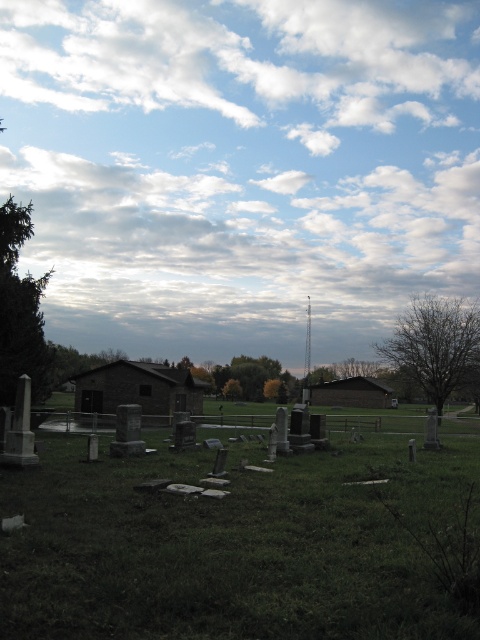
Question: Is cloudy sky at upper center thinner than green grassy at lower center?

Choices:
 (A) no
 (B) yes

Answer: (A)

Question: Which object is positioned closest to the cloudy sky at upper center?

Choices:
 (A) green grassy at lower center
 (B) green textured tree at left

Answer: (B)

Question: Considering the real-world distances, which object is farthest from the green textured tree at left?

Choices:
 (A) cloudy sky at upper center
 (B) bare branches at right
 (C) green grassy at lower center

Answer: (A)

Question: Observing the image, what is the correct spatial positioning of cloudy sky at upper center in reference to green textured tree at left?

Choices:
 (A) below
 (B) above

Answer: (B)

Question: Which object is farther from the camera taking this photo?

Choices:
 (A) green grassy at lower center
 (B) green textured tree at left
 (C) bare branches at right

Answer: (C)

Question: Is cloudy sky at upper center wider than green grassy at lower center?

Choices:
 (A) yes
 (B) no

Answer: (A)